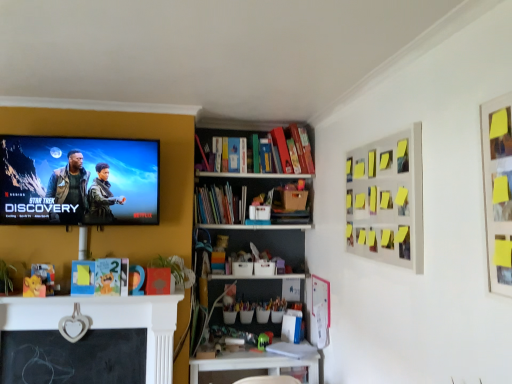
What are the coordinates of `empty space that is ontop of white plastic table at lower center (from a real-world perspective)` in the screenshot? It's located at (257, 348).